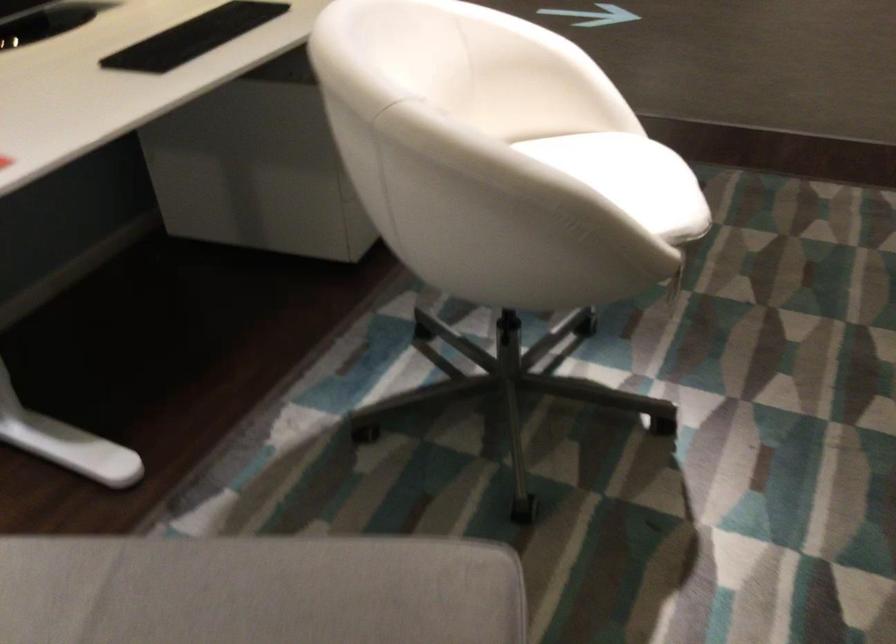
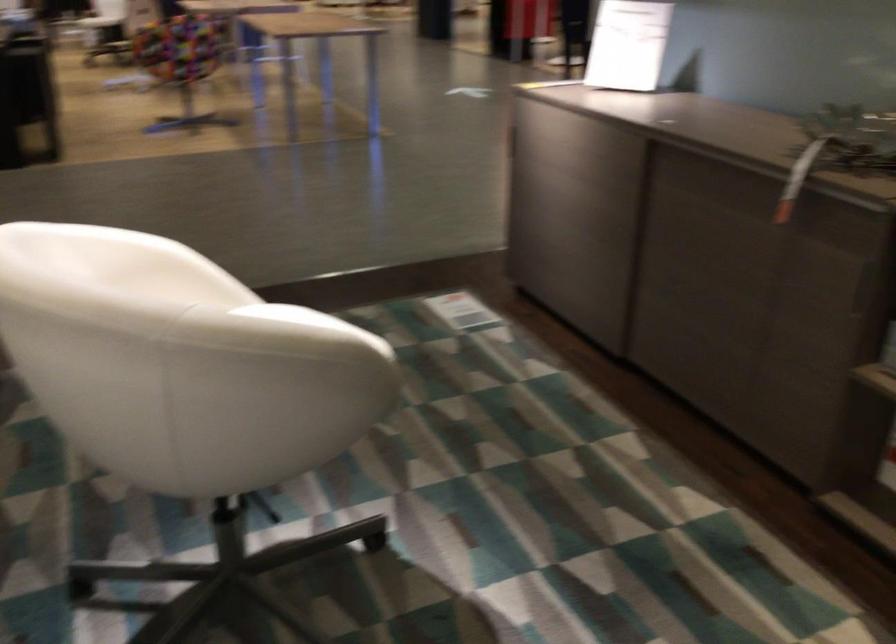
Find the pixel in the second image that matches (x=515, y=149) in the first image.

(307, 321)